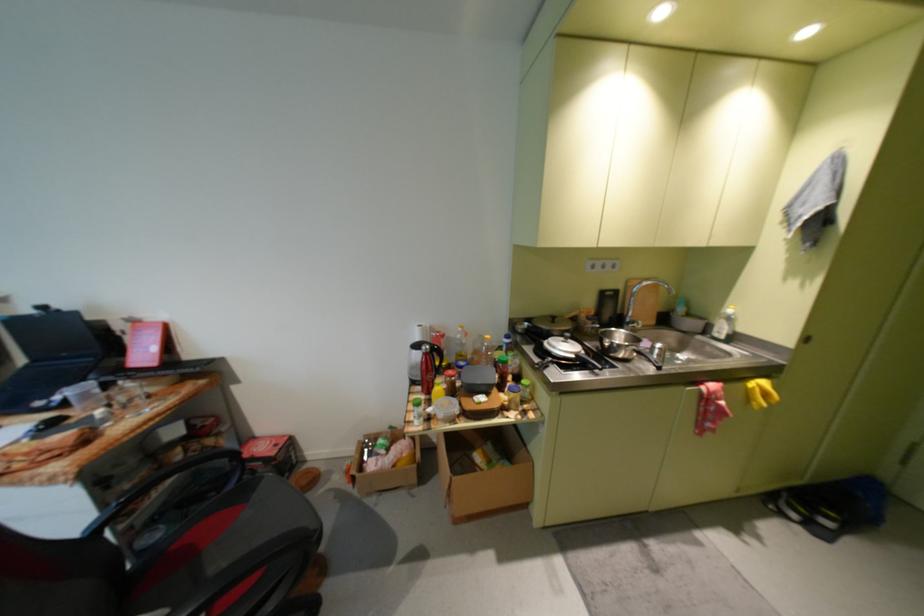
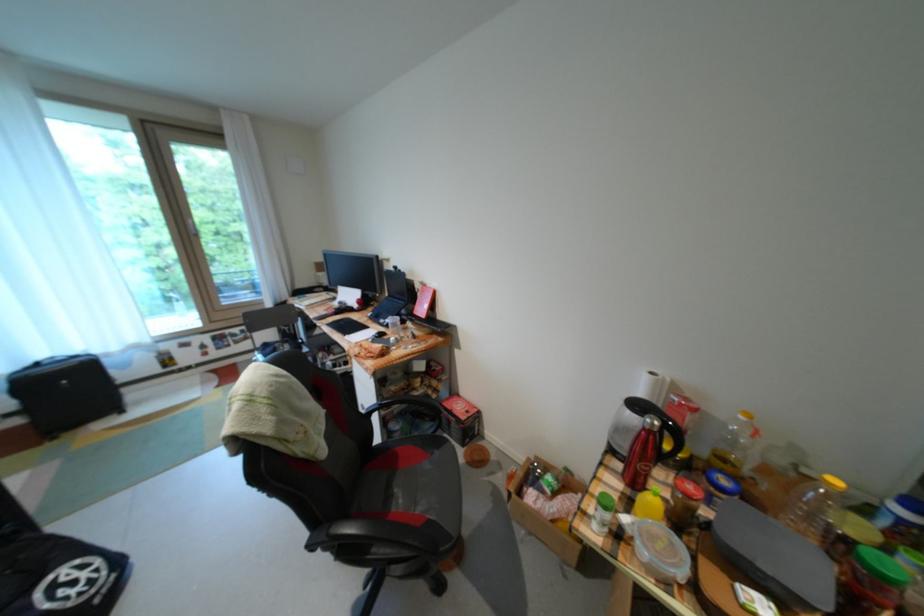
Where in the second image is the point corresponding to point 469,371 from the first image?

(723, 490)